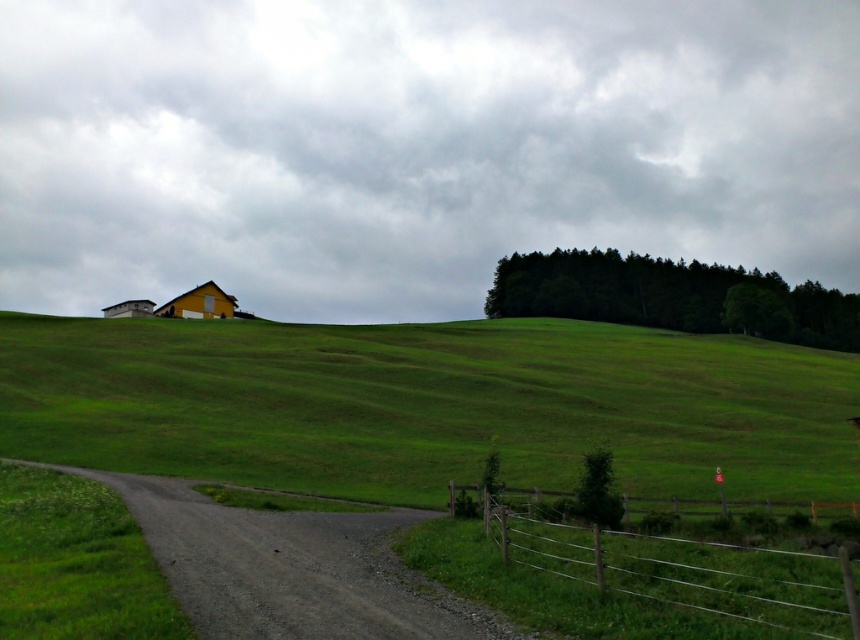
Question: Which object appears farthest from the camera in this image?

Choices:
 (A) green grassy hillside at center
 (B) wooden fence at lower right

Answer: (A)

Question: Can you confirm if green grassy hillside at center is thinner than wooden fence at lower right?

Choices:
 (A) no
 (B) yes

Answer: (A)

Question: Which point is farther from the camera taking this photo?

Choices:
 (A) (335, 403)
 (B) (570, 552)

Answer: (A)

Question: Can you confirm if green grassy hillside at center is thinner than wooden fence at lower right?

Choices:
 (A) yes
 (B) no

Answer: (B)

Question: Does green grassy hillside at center have a larger size compared to wooden fence at lower right?

Choices:
 (A) yes
 (B) no

Answer: (A)